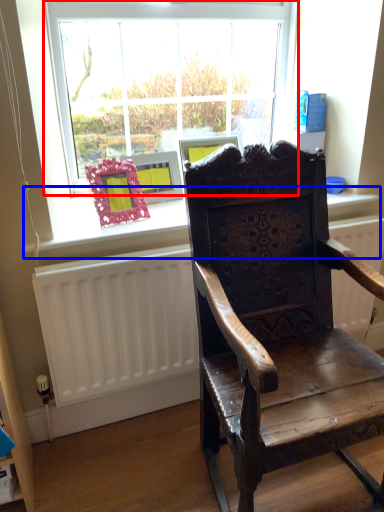
Question: Which object is closer to the camera taking this photo, window (highlighted by a red box) or window sill (highlighted by a blue box)?

Choices:
 (A) window
 (B) window sill

Answer: (B)